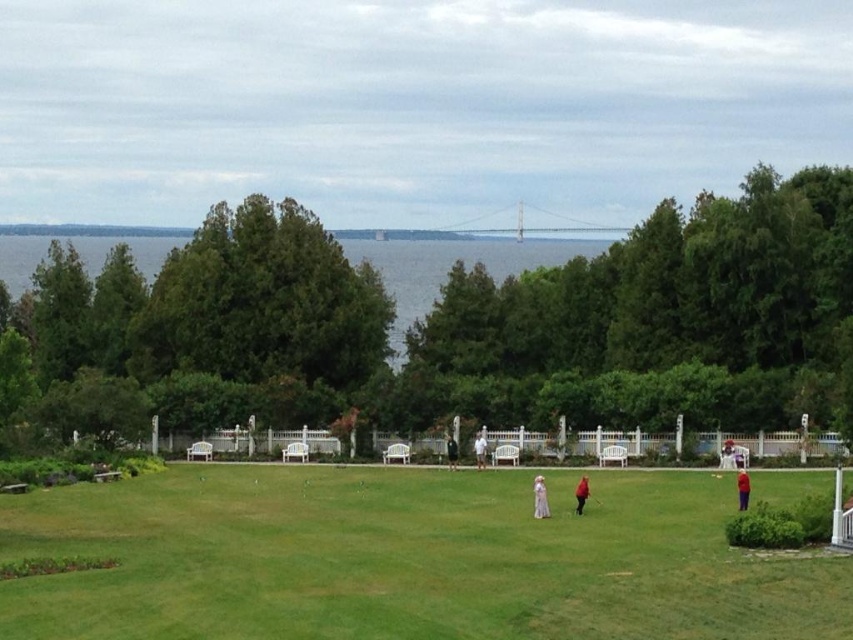
Question: Observing the image, what is the correct spatial positioning of red fabric person at center in reference to white cotton dress at center?

Choices:
 (A) right
 (B) left

Answer: (A)

Question: Does red fabric person at center have a lesser width compared to white cotton dress at center?

Choices:
 (A) no
 (B) yes

Answer: (A)

Question: Is green grass at center bigger than red velvet coat at lower right?

Choices:
 (A) no
 (B) yes

Answer: (B)

Question: Estimate the real-world distances between objects in this image. Which object is closer to the dark gray sweater at center?

Choices:
 (A) light beige cotton dress at center
 (B) red velvet coat at lower right
 (C) red fabric person at center

Answer: (A)

Question: Among these objects, which one is farthest from the camera?

Choices:
 (A) dark gray sweater at center
 (B) red velvet coat at lower right
 (C) red fabric person at center

Answer: (A)

Question: Among these objects, which one is nearest to the camera?

Choices:
 (A) white cotton dress at center
 (B) dark gray sweater at center

Answer: (A)